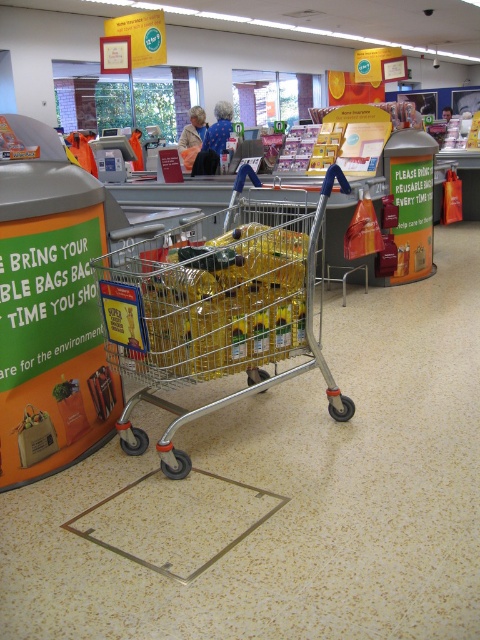
Identify the location of silver/metallic shopping cart at center. (216, 308).

Does silver/metallic shopping cart at center have a lesser height compared to metallic yellow oil at center?

Incorrect, silver/metallic shopping cart at center's height does not fall short of metallic yellow oil at center's.

Find the location of a particular element. Image resolution: width=480 pixels, height=640 pixels. silver/metallic shopping cart at center is located at coordinates (216, 308).

Where is `silver/metallic shopping cart at center`? This screenshot has width=480, height=640. silver/metallic shopping cart at center is located at coordinates (216, 308).